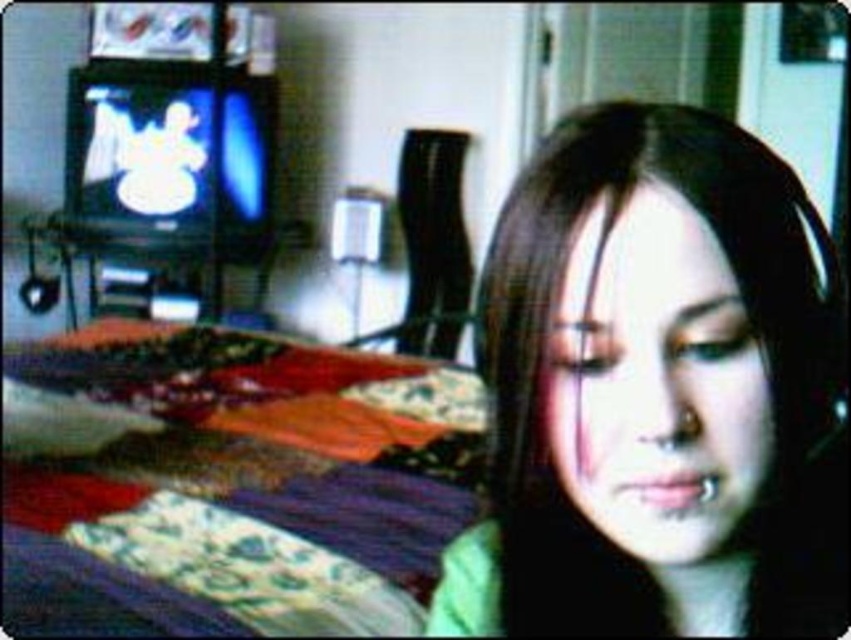
Find the location of a particular element. The height and width of the screenshot is (640, 851). matte green shirt at center is located at coordinates (655, 394).

Is matte green shirt at center to the right of multicolored fabric bed at lower left from the viewer's perspective?

Correct, you'll find matte green shirt at center to the right of multicolored fabric bed at lower left.

I want to click on matte green shirt at center, so click(655, 394).